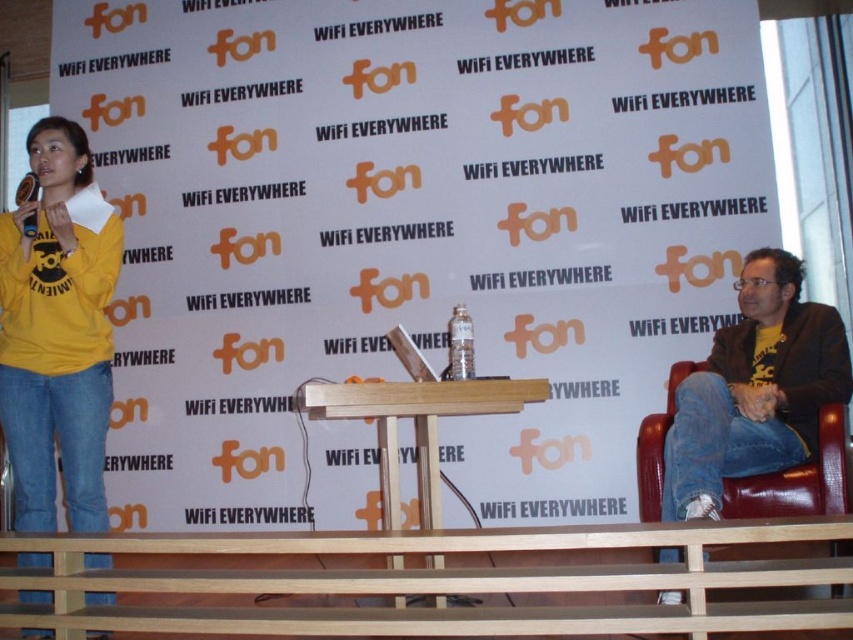
Question: Based on their relative distances, which object is nearer to the leather at right?

Choices:
 (A) wooden at center
 (B) yellow cotton sweatshirt at left

Answer: (A)

Question: Does wooden at center appear under leather at right?

Choices:
 (A) no
 (B) yes

Answer: (B)

Question: Is wooden at center bigger than leather at right?

Choices:
 (A) no
 (B) yes

Answer: (B)

Question: Which object is the closest to the yellow cotton sweatshirt at left?

Choices:
 (A) leather at right
 (B) wooden at center

Answer: (B)

Question: Which object appears farthest from the camera in this image?

Choices:
 (A) wooden at center
 (B) leather at right

Answer: (B)

Question: Is yellow cotton sweatshirt at left wider than leather at right?

Choices:
 (A) no
 (B) yes

Answer: (A)